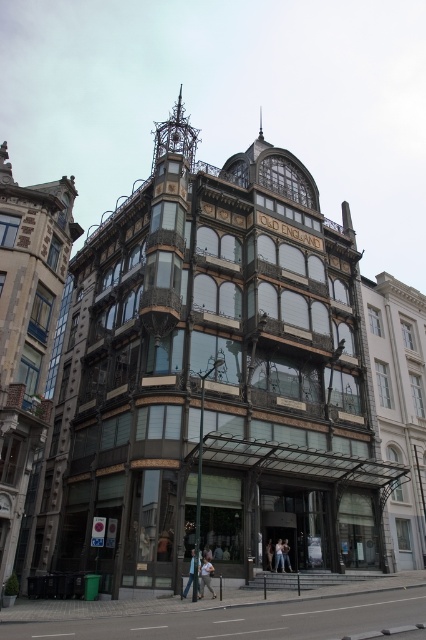
Which of these two, light beige fabric jacket at center or light brown leather jacket at center, stands shorter?

Standing shorter between the two is light brown leather jacket at center.

Does light beige fabric jacket at center appear under light brown leather jacket at center?

Yes, light beige fabric jacket at center is below light brown leather jacket at center.

The width and height of the screenshot is (426, 640). What are the coordinates of `light beige fabric jacket at center` in the screenshot? It's located at (268, 554).

This screenshot has height=640, width=426. I want to click on light beige fabric jacket at center, so click(x=268, y=554).

Can you confirm if light blue denim jeans at lower center is positioned above light brown leather jacket at center?

Incorrect, light blue denim jeans at lower center is not positioned above light brown leather jacket at center.

Who is more distant from viewer, (285, 557) or (204, 548)?

Point (285, 557)

You are a GUI agent. You are given a task and a screenshot of the screen. Output one action in this format:
    pyautogui.click(x=<x>, y=<y>)
    Task: Click on the light blue denim jeans at lower center
    Image resolution: width=426 pixels, height=640 pixels.
    Given the screenshot: What is the action you would take?
    pyautogui.click(x=285, y=556)

Is light blue jeans at lower center to the left of light blue jeans at center from the viewer's perspective?

In fact, light blue jeans at lower center is to the right of light blue jeans at center.

The height and width of the screenshot is (640, 426). Describe the element at coordinates (207, 577) in the screenshot. I see `light blue jeans at lower center` at that location.

Which is in front, point (207, 584) or point (189, 577)?

Point (207, 584) is in front.

The height and width of the screenshot is (640, 426). Identify the location of light blue jeans at lower center. (207, 577).